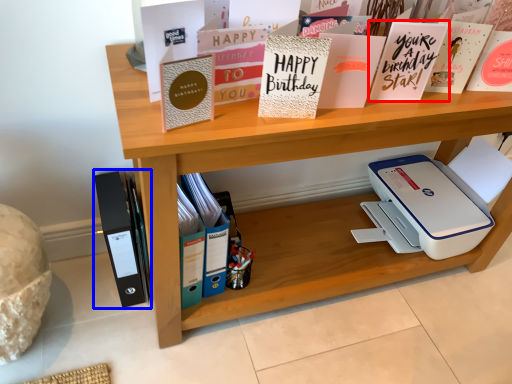
Question: Among these objects, which one is farthest to the camera, paperback book (highlighted by a red box) or journal (highlighted by a blue box)?

Choices:
 (A) paperback book
 (B) journal

Answer: (B)